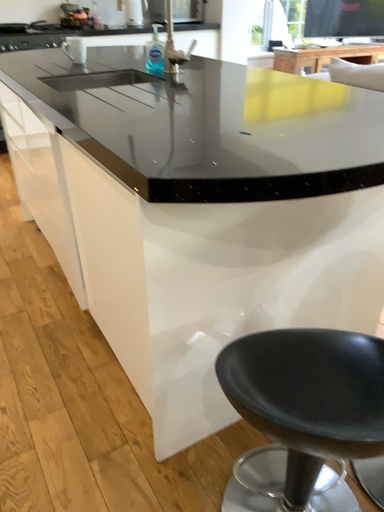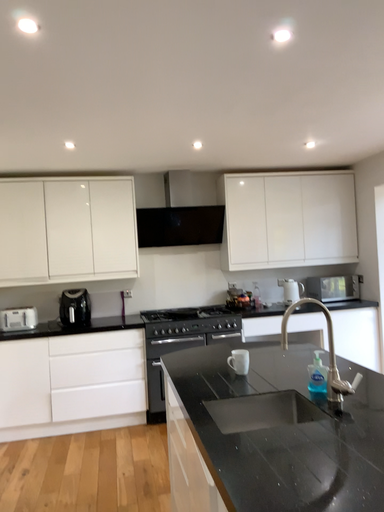
Question: How did the camera likely rotate when shooting the video?

Choices:
 (A) rotated left
 (B) rotated right

Answer: (A)